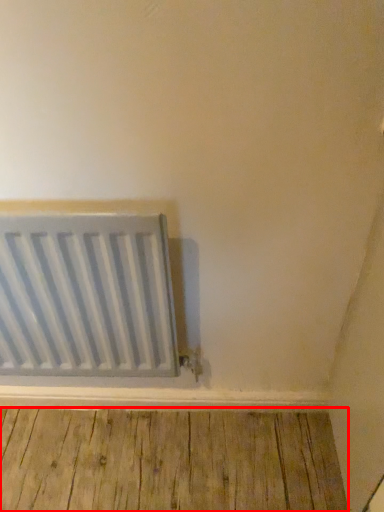
Question: From the image's perspective, what is the correct spatial relationship of hardwood (annotated by the red box) in relation to radiator?

Choices:
 (A) above
 (B) below

Answer: (B)